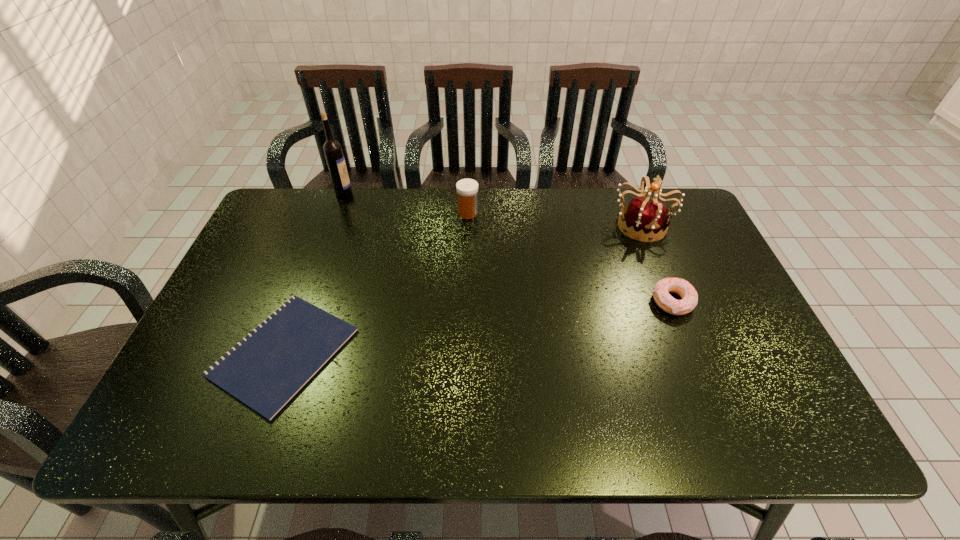
Identify the location of vacant space located on the right of the second shortest object. (731, 302).

The height and width of the screenshot is (540, 960). I want to click on vacant area situated on the right of the notepad, so click(378, 353).

Image resolution: width=960 pixels, height=540 pixels. I want to click on wine bottle located at the far edge, so click(x=332, y=149).

This screenshot has width=960, height=540. Identify the location of tiara that is positioned at the far edge. (642, 216).

Locate an element on the screen. This screenshot has height=540, width=960. medicine at the far edge is located at coordinates (467, 189).

Locate an element on the screen. object at the near edge is located at coordinates (265, 370).

Where is `object at the left edge`? The height and width of the screenshot is (540, 960). object at the left edge is located at coordinates (265, 370).

Image resolution: width=960 pixels, height=540 pixels. What are the coordinates of `tiara that is positioned at the right edge` in the screenshot? It's located at (642, 216).

Locate an element on the screen. doughnut that is at the right edge is located at coordinates (683, 288).

I want to click on object positioned at the near left corner, so click(x=265, y=370).